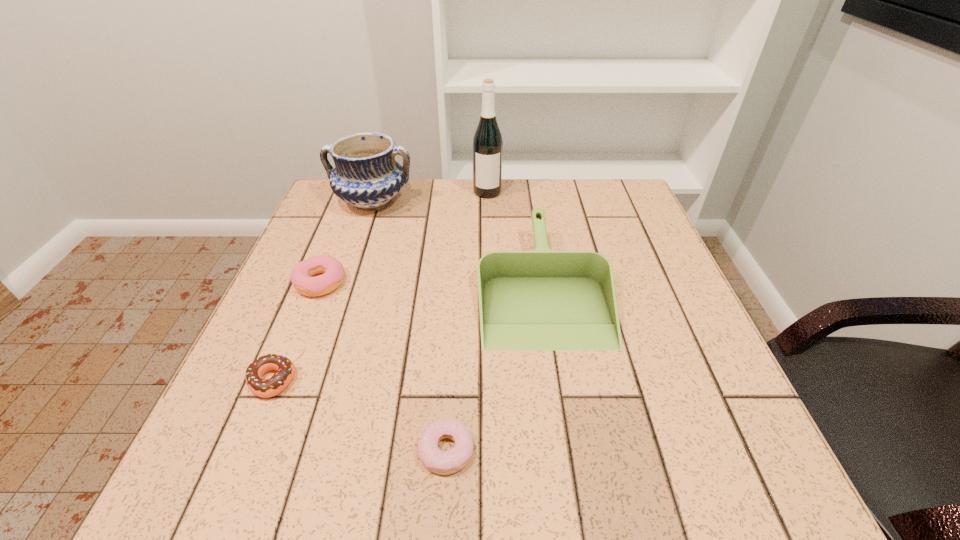
This screenshot has height=540, width=960. I want to click on free region located on the scoop of the dustpan, so click(x=561, y=401).

The width and height of the screenshot is (960, 540). What are the coordinates of `vacant position located on the front of the farthest doughnut` in the screenshot? It's located at (278, 390).

Locate an element on the screen. vacant space located on the right of the second nearest doughnut is located at coordinates (386, 381).

Image resolution: width=960 pixels, height=540 pixels. I want to click on free space located on the back of the shortest doughnut, so click(450, 375).

Identify the location of wine bottle at the far edge. This screenshot has width=960, height=540. (487, 142).

Find the location of a particular element. This screenshot has width=960, height=540. pottery at the far edge is located at coordinates (366, 175).

Locate an element on the screen. The width and height of the screenshot is (960, 540). object located in the near edge section of the desktop is located at coordinates (437, 461).

I want to click on pottery that is at the left edge, so click(366, 175).

In order to click on object present at the right edge in this screenshot , I will do `click(542, 299)`.

I want to click on object present at the far left corner, so point(366,175).